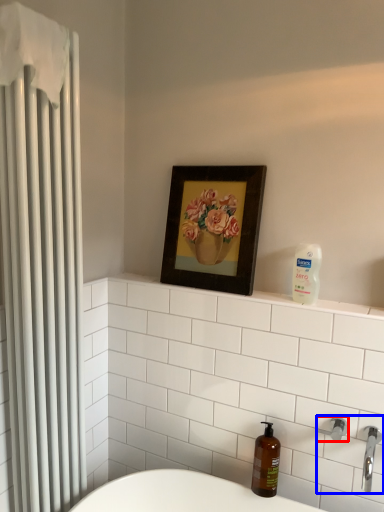
Question: Among these objects, which one is farthest to the camera, shower (highlighted by a red box) or sink (highlighted by a blue box)?

Choices:
 (A) shower
 (B) sink

Answer: (A)